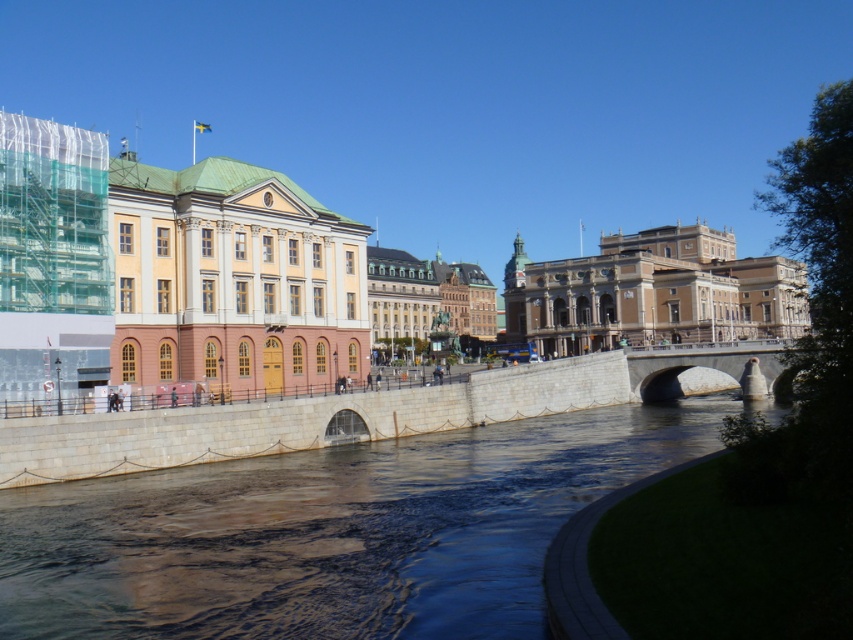
Question: Which of the following is the farthest from the observer?

Choices:
 (A) (788, 340)
 (B) (532, 301)

Answer: (B)

Question: Which object is the closest to the matte yellow wood palace at center?

Choices:
 (A) gray stone bridge at center
 (B) beige stone building at center

Answer: (A)

Question: Does beige stone building at center have a greater width compared to gray stone bridge at center?

Choices:
 (A) yes
 (B) no

Answer: (A)

Question: Can you confirm if clear water at center is positioned above matte yellow wood palace at center?

Choices:
 (A) no
 (B) yes

Answer: (A)

Question: Which point is farther from the camera taking this photo?

Choices:
 (A) (761, 355)
 (B) (466, 428)
 (C) (294, 228)
 (D) (634, 278)

Answer: (D)

Question: Is matte yellow wood palace at center bigger than beige stone building at center?

Choices:
 (A) yes
 (B) no

Answer: (B)